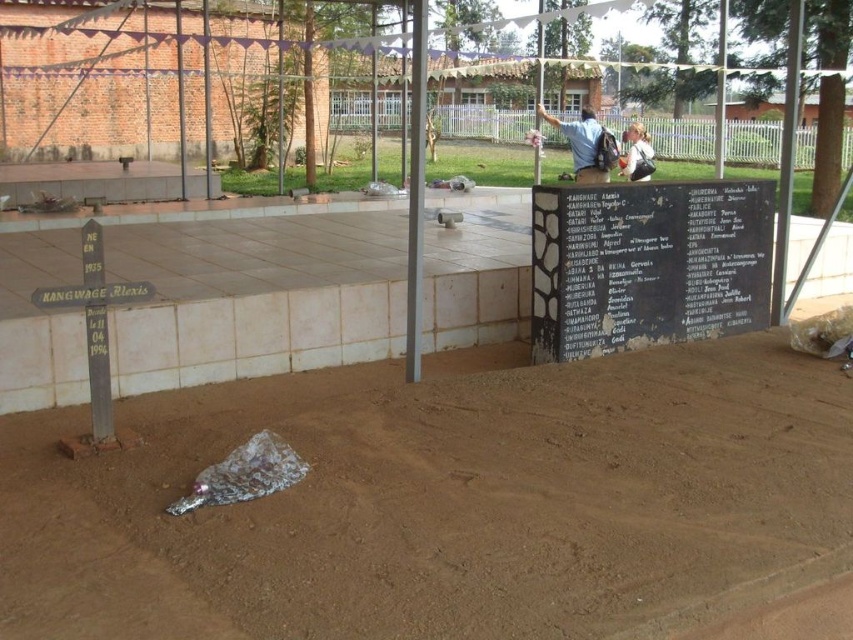
Is brown dirt track at center to the left of light brown leather backpack at upper center from the viewer's perspective?

Indeed, brown dirt track at center is positioned on the left side of light brown leather backpack at upper center.

Which is more to the left, brown dirt track at center or light brown leather backpack at upper center?

Positioned to the left is brown dirt track at center.

Where is `brown dirt track at center`? This screenshot has height=640, width=853. brown dirt track at center is located at coordinates (453, 506).

Looking at this image, who is taller, blue fabric backpack at upper center or light brown leather backpack at upper center?

With more height is blue fabric backpack at upper center.

Is blue fabric backpack at upper center further to the viewer compared to light brown leather backpack at upper center?

No, blue fabric backpack at upper center is in front of light brown leather backpack at upper center.

Between point (560, 122) and point (643, 157), which one is positioned in front?

Point (560, 122) is in front.

Where is `blue fabric backpack at upper center`? Image resolution: width=853 pixels, height=640 pixels. blue fabric backpack at upper center is located at coordinates (587, 145).

Does brown dirt track at center appear on the left side of blue fabric backpack at upper center?

Correct, you'll find brown dirt track at center to the left of blue fabric backpack at upper center.

Between brown dirt track at center and blue fabric backpack at upper center, which one is positioned higher?

blue fabric backpack at upper center is higher up.

Between point (489, 442) and point (595, 141), which one is positioned behind?

Positioned behind is point (595, 141).

At what (x,y) coordinates should I click in order to perform the action: click on brown dirt track at center. Please return your answer as a coordinate pair (x, y). This screenshot has width=853, height=640. Looking at the image, I should click on (453, 506).